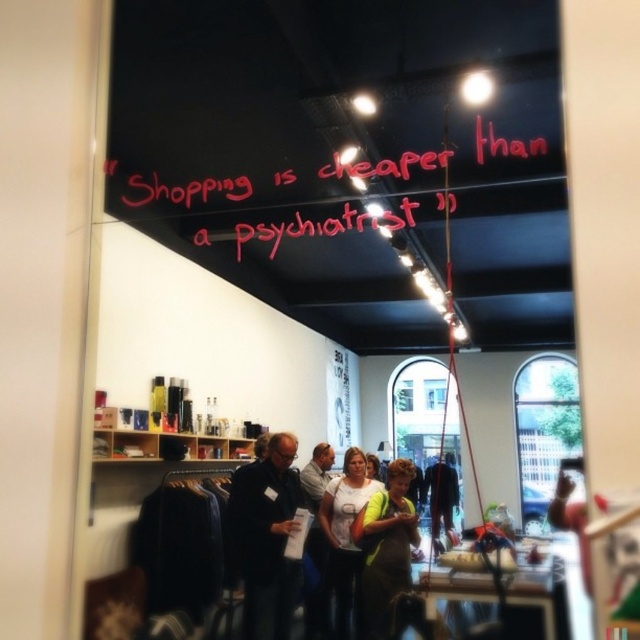
You are a customer in the store and want to take a photo of the pink neon sign at upper center and the dark blue jeans at center. How far apart are these two items in the store?

The pink neon sign at upper center is 4.54 meters from the dark blue jeans at center, so they are 4.54 meters apart in the store.

You are a customer in the store and want to take a photo of both the point at location (294, 176) and the point at (433, 545). Since the camera can only focus on one point at a time, which point should you focus on first to ensure the other is still in the frame?

You should focus on point (294, 176) first because it is closer to the camera than point (433, 545). This ensures that when you adjust the focus, the farther point will remain within the frame while maintaining clarity for the closer one.

You are a customer in the store looking at the dark blue shirt at center and the neon green reflective vest at center. Which item is positioned higher in the reflection?

The dark blue shirt at center is positioned higher than the neon green reflective vest at center in the reflection.